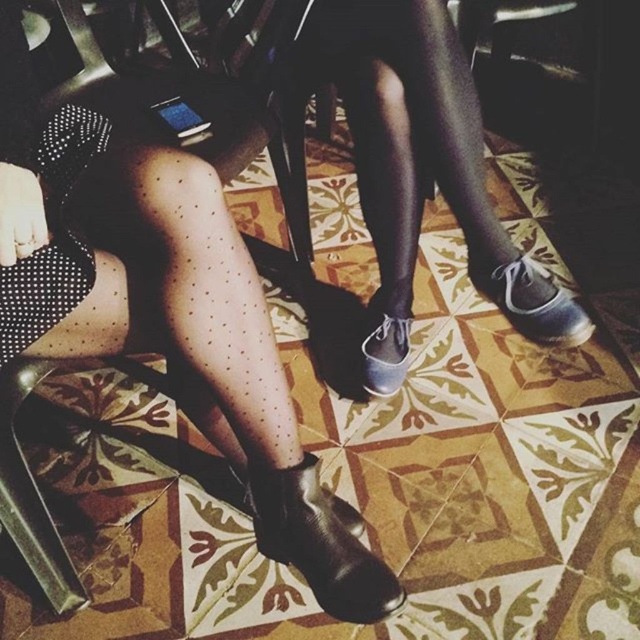
Question: Is black dotted tights at lower left further to camera compared to matte black boot at center?

Choices:
 (A) yes
 (B) no

Answer: (B)

Question: Which object is positioned farthest from the white leather shoe at lower right?

Choices:
 (A) matte black shoe at lower center
 (B) black dotted tights at lower left
 (C) matte black boot at center

Answer: (B)

Question: Which object is positioned farthest from the matte black boot at center?

Choices:
 (A) black dotted tights at lower left
 (B) matte black shoe at lower center
 (C) matte black boots at lower center

Answer: (A)

Question: Which point is farther to the camera?

Choices:
 (A) black dotted tights at lower left
 (B) matte black tights at center
 (C) black leather boot at lower center
 (D) matte black boot at center

Answer: (D)

Question: Considering the relative positions of black leather boot at lower center and matte black boot at center in the image provided, where is black leather boot at lower center located with respect to matte black boot at center?

Choices:
 (A) right
 (B) left

Answer: (B)

Question: Is matte black boots at lower center positioned before white leather shoe at lower right?

Choices:
 (A) no
 (B) yes

Answer: (B)